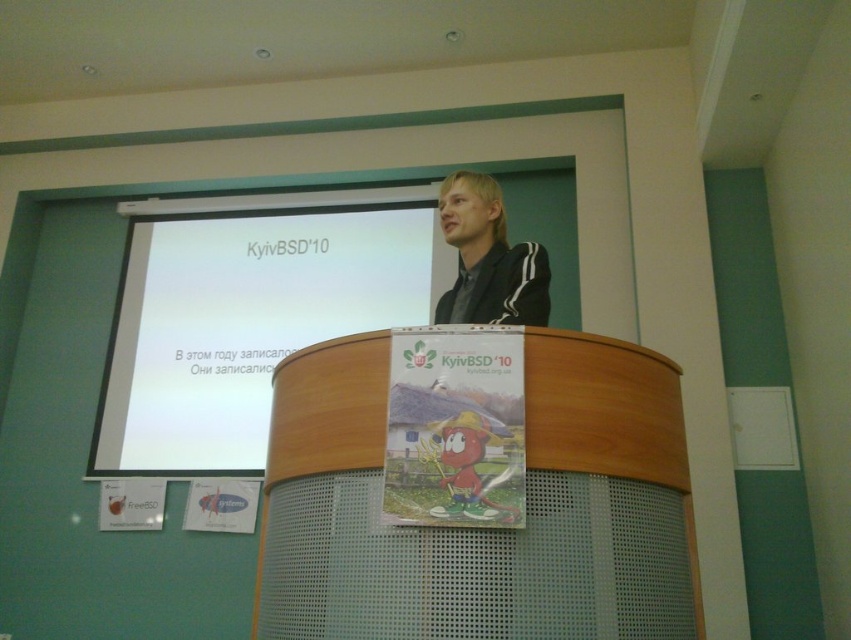
You are a photographer in the audience. You want to take a photo of the black matte jacket at upper center and the white matte projection screen at upper center. Which object should you focus on first if you want to capture both in a single shot without moving the camera?

The white matte projection screen at upper center is to the left of the black matte jacket at upper center. Since they are both at upper center, you can focus on either one first as they are at the same distance from the camera. Adjust your lens to ensure both are in the frame.

You are organizing an event and need to place a 1.5 meter wide banner between the wooden podium at center and the black matte jacket at upper center. Can you fit it there based on their widths?

The wooden podium at center might be wider than black matte jacket at upper center, so the banner may not fit if the space between them is narrower than 1.5 meters. Check the actual dimensions before placing the banner.